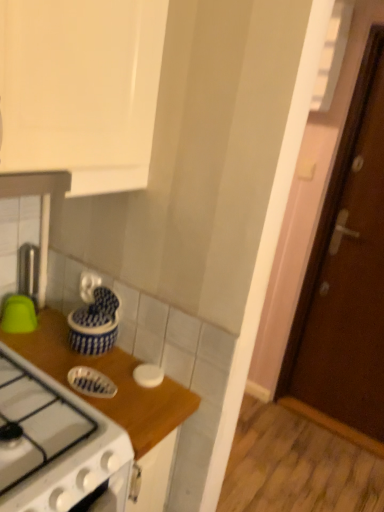
Locate an element on the screen. This screenshot has width=384, height=512. green matte bowl at left, acting as the fourth kitchen appliance starting from the right is located at coordinates (18, 315).

I want to click on wooden at upper right, so click(112, 379).

Where is `blue glossy jar at center, which ranks as the third kitchen appliance in right-to-left order`? blue glossy jar at center, which ranks as the third kitchen appliance in right-to-left order is located at coordinates (95, 323).

The width and height of the screenshot is (384, 512). Identify the location of blue glossy dish at center, arranged as the 2th kitchen appliance when viewed from the right. (91, 382).

The height and width of the screenshot is (512, 384). I want to click on white matte lid at center, which is counted as the first kitchen appliance, starting from the right, so click(x=148, y=375).

Is brown wooden door at right situated inside green matte bowl at left, acting as the fourth kitchen appliance starting from the right, or outside?

brown wooden door at right is located beyond the bounds of green matte bowl at left, acting as the fourth kitchen appliance starting from the right.

Between brown wooden door at right and green matte bowl at left, acting as the fourth kitchen appliance starting from the right, which one appears on the left side from the viewer's perspective?

Positioned to the left is green matte bowl at left, acting as the fourth kitchen appliance starting from the right.

Could you tell me if brown wooden door at right is turned towards green matte bowl at left, acting as the fourth kitchen appliance starting from the right?

No, brown wooden door at right is not oriented towards green matte bowl at left, acting as the fourth kitchen appliance starting from the right.

Which object is closer to the camera, brown wooden door at right or green matte bowl at left, acting as the fourth kitchen appliance starting from the right?

green matte bowl at left, acting as the fourth kitchen appliance starting from the right, is in front.

Who is bigger, green matte bowl at left, acting as the fourth kitchen appliance starting from the right, or brown wooden door at right?

Bigger between the two is brown wooden door at right.

Could you tell me if green matte bowl at left, placed as the 1th kitchen appliance when sorted from left to right, is facing brown wooden door at right?

No, green matte bowl at left, placed as the 1th kitchen appliance when sorted from left to right, is not oriented towards brown wooden door at right.

From the picture: Which is closer to the camera, (x=7, y=302) or (x=358, y=359)?

Point (x=7, y=302) appears to be closer to the viewer than point (x=358, y=359).

Is green matte bowl at left, placed as the 1th kitchen appliance when sorted from left to right, positioned beyond the bounds of wooden at upper right?

Indeed, green matte bowl at left, placed as the 1th kitchen appliance when sorted from left to right, is completely outside wooden at upper right.

Are green matte bowl at left, acting as the fourth kitchen appliance starting from the right, and wooden at upper right far apart?

green matte bowl at left, acting as the fourth kitchen appliance starting from the right, is actually quite close to wooden at upper right.

In the image, is green matte bowl at left, placed as the 1th kitchen appliance when sorted from left to right, positioned in front of or behind wooden at upper right?

In the image, green matte bowl at left, placed as the 1th kitchen appliance when sorted from left to right, appears behind wooden at upper right.

In order to click on kitchen appliance that is the 3rd one above the wooden at upper right (from a real-world perspective) in this screenshot , I will do `click(18, 315)`.

From a real-world perspective, is brown wooden door at right positioned above or below blue glossy jar at center, which ranks as the third kitchen appliance in right-to-left order?

brown wooden door at right is situated higher than blue glossy jar at center, which ranks as the third kitchen appliance in right-to-left order, in the real world.

Considering the relative positions of brown wooden door at right and blue glossy jar at center, which is counted as the second kitchen appliance, starting from the left, in the image provided, is brown wooden door at right to the left of blue glossy jar at center, which is counted as the second kitchen appliance, starting from the left, from the viewer's perspective?

Incorrect, brown wooden door at right is not on the left side of blue glossy jar at center, which is counted as the second kitchen appliance, starting from the left.

Does brown wooden door at right have a smaller size compared to blue glossy jar at center, which ranks as the third kitchen appliance in right-to-left order?

Actually, brown wooden door at right might be larger than blue glossy jar at center, which ranks as the third kitchen appliance in right-to-left order.

What's the angular difference between brown wooden door at right and blue glossy jar at center, which is counted as the second kitchen appliance, starting from the left,'s facing directions?

The facing directions of brown wooden door at right and blue glossy jar at center, which is counted as the second kitchen appliance, starting from the left, are 89.9 degrees apart.

Which is more to the left, blue glossy jar at center, which ranks as the third kitchen appliance in right-to-left order, or blue glossy dish at center, arranged as the 2th kitchen appliance when viewed from the right?

Positioned to the left is blue glossy jar at center, which ranks as the third kitchen appliance in right-to-left order.

Could you tell me if blue glossy jar at center, which ranks as the third kitchen appliance in right-to-left order, is facing blue glossy dish at center, the 3th kitchen appliance from the left?

No, blue glossy jar at center, which ranks as the third kitchen appliance in right-to-left order, is not oriented towards blue glossy dish at center, the 3th kitchen appliance from the left.

Which object is further away from the camera, blue glossy jar at center, which ranks as the third kitchen appliance in right-to-left order, or blue glossy dish at center, arranged as the 2th kitchen appliance when viewed from the right?

Positioned behind is blue glossy jar at center, which ranks as the third kitchen appliance in right-to-left order.

Can we say wooden at upper right lies outside blue glossy jar at center, which ranks as the third kitchen appliance in right-to-left order?

That's correct, wooden at upper right is outside of blue glossy jar at center, which ranks as the third kitchen appliance in right-to-left order.

Is wooden at upper right to the left of blue glossy jar at center, which is counted as the second kitchen appliance, starting from the left, from the viewer's perspective?

Indeed, wooden at upper right is positioned on the left side of blue glossy jar at center, which is counted as the second kitchen appliance, starting from the left.

From a real-world perspective, is wooden at upper right on blue glossy jar at center, which ranks as the third kitchen appliance in right-to-left order?

No, from a real-world perspective, wooden at upper right is not above blue glossy jar at center, which ranks as the third kitchen appliance in right-to-left order.

Is point (116, 401) closer or farther from the camera than point (87, 330)?

Point (116, 401) is positioned closer to the camera compared to point (87, 330).

From the image's perspective, is brown wooden door at right above or below blue glossy dish at center, the 3th kitchen appliance from the left?

From the image's perspective, brown wooden door at right appears above blue glossy dish at center, the 3th kitchen appliance from the left.

Is brown wooden door at right oriented away from blue glossy dish at center, arranged as the 2th kitchen appliance when viewed from the right?

No, brown wooden door at right's orientation is not away from blue glossy dish at center, arranged as the 2th kitchen appliance when viewed from the right.

From a real-world perspective, does brown wooden door at right sit lower than blue glossy dish at center, arranged as the 2th kitchen appliance when viewed from the right?

Actually, brown wooden door at right is physically above blue glossy dish at center, arranged as the 2th kitchen appliance when viewed from the right, in the real world.

You are a GUI agent. You are given a task and a screenshot of the screen. Output one action in this format:
    pyautogui.click(x=<x>, y=<y>)
    Task: Click on the 4th kitchen appliance counting from the left of the brown wooden door at right
    The image size is (384, 512).
    Given the screenshot: What is the action you would take?
    18,315

Identify the location of door on the right of green matte bowl at left, placed as the 1th kitchen appliance when sorted from left to right. Image resolution: width=384 pixels, height=512 pixels. (346, 278).

From the picture: Looking at the image, which one is located closer to blue glossy jar at center, which ranks as the third kitchen appliance in right-to-left order, wooden at upper right or white matte lid at center, the fourth kitchen appliance viewed from the left?

Among the two, wooden at upper right is located nearer to blue glossy jar at center, which ranks as the third kitchen appliance in right-to-left order.

When comparing their distances from green matte bowl at left, acting as the fourth kitchen appliance starting from the right, does wooden at upper right or blue glossy jar at center, which ranks as the third kitchen appliance in right-to-left order, seem closer?

Among the two, blue glossy jar at center, which ranks as the third kitchen appliance in right-to-left order, is located nearer to green matte bowl at left, acting as the fourth kitchen appliance starting from the right.

Looking at the image, which one is located further to blue glossy dish at center, the 3th kitchen appliance from the left, wooden at upper right or brown wooden door at right?

brown wooden door at right is further to blue glossy dish at center, the 3th kitchen appliance from the left.

Which object lies further to the anchor point blue glossy jar at center, which is counted as the second kitchen appliance, starting from the left, wooden at upper right or blue glossy dish at center, the 3th kitchen appliance from the left?

blue glossy dish at center, the 3th kitchen appliance from the left.

When comparing their distances from brown wooden door at right, does blue glossy jar at center, which ranks as the third kitchen appliance in right-to-left order, or wooden at upper right seem further?

wooden at upper right is positioned further to the anchor brown wooden door at right.

When comparing their distances from blue glossy dish at center, the 3th kitchen appliance from the left, does white matte lid at center, which is counted as the first kitchen appliance, starting from the right, or blue glossy jar at center, which ranks as the third kitchen appliance in right-to-left order, seem closer?

white matte lid at center, which is counted as the first kitchen appliance, starting from the right, lies closer to blue glossy dish at center, the 3th kitchen appliance from the left, than the other object.

Based on their spatial positions, is green matte bowl at left, acting as the fourth kitchen appliance starting from the right, or blue glossy jar at center, which ranks as the third kitchen appliance in right-to-left order, further from wooden at upper right?

green matte bowl at left, acting as the fourth kitchen appliance starting from the right, is positioned further to the anchor wooden at upper right.

When comparing their distances from brown wooden door at right, does green matte bowl at left, acting as the fourth kitchen appliance starting from the right, or blue glossy jar at center, which is counted as the second kitchen appliance, starting from the left, seem further?

The object further to brown wooden door at right is green matte bowl at left, acting as the fourth kitchen appliance starting from the right.

Find the location of `kitchen appliance between blue glossy dish at center, arranged as the 2th kitchen appliance when viewed from the right, and brown wooden door at right from left to right`. kitchen appliance between blue glossy dish at center, arranged as the 2th kitchen appliance when viewed from the right, and brown wooden door at right from left to right is located at coordinates (148, 375).

At what (x,y) coordinates should I click in order to perform the action: click on kitchen appliance between blue glossy dish at center, the 3th kitchen appliance from the left, and wooden at upper right, in the vertical direction. Please return your answer as a coordinate pair (x, y). This screenshot has height=512, width=384. Looking at the image, I should click on (148, 375).

Identify the location of countertop located between green matte bowl at left, placed as the 1th kitchen appliance when sorted from left to right, and brown wooden door at right in the left-right direction. (112, 379).

Locate an element on the screen. countertop between green matte bowl at left, acting as the fourth kitchen appliance starting from the right, and white matte lid at center, which is counted as the first kitchen appliance, starting from the right is located at coordinates (112, 379).